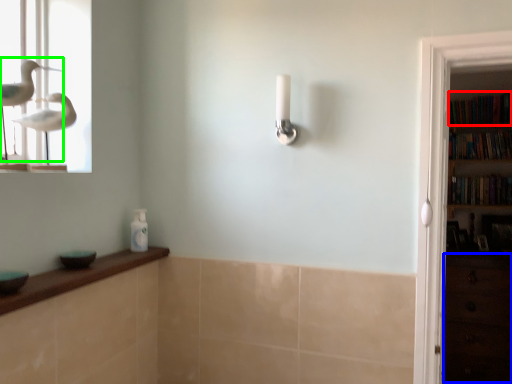
Question: Which object is the closest to the book (highlighted by a red box)? Choose among these: drawer (highlighted by a blue box) or bird (highlighted by a green box).

Choices:
 (A) drawer
 (B) bird

Answer: (A)